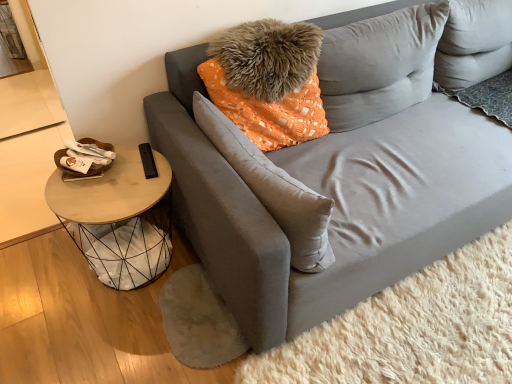
Locate an element on the screen. This screenshot has width=512, height=384. space that is in front of woodenmaterial/texture side table at left is located at coordinates point(94,341).